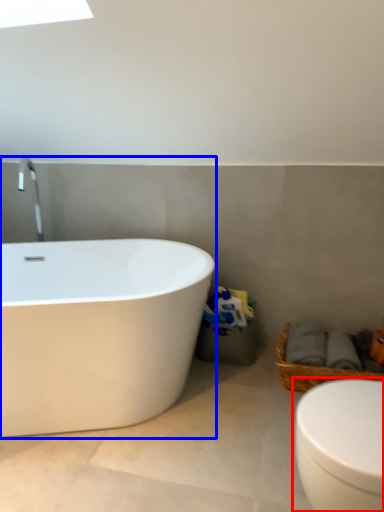
Question: Which point is further to the camera, toilet (highlighted by a red box) or bathtub (highlighted by a blue box)?

Choices:
 (A) toilet
 (B) bathtub

Answer: (B)